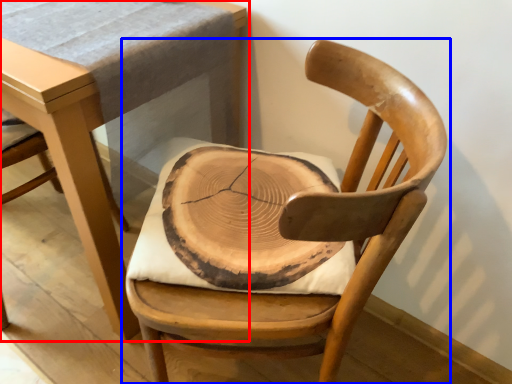
Question: Which object is closer to the camera taking this photo, table (highlighted by a red box) or chair (highlighted by a blue box)?

Choices:
 (A) table
 (B) chair

Answer: (B)